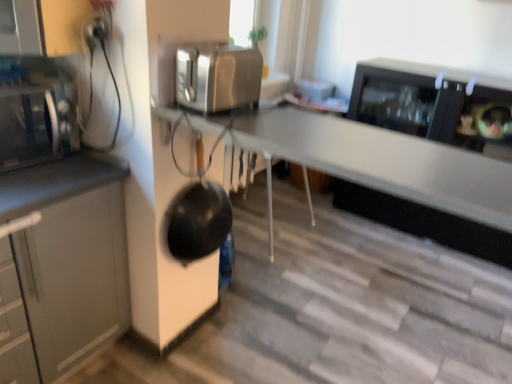
Question: Are matte black microwave at left and black matte wok at center far apart?

Choices:
 (A) no
 (B) yes

Answer: (A)

Question: From the image's perspective, is matte black microwave at left below black matte wok at center?

Choices:
 (A) yes
 (B) no

Answer: (B)

Question: Is matte black microwave at left closer to the viewer compared to black matte wok at center?

Choices:
 (A) yes
 (B) no

Answer: (A)

Question: Considering the relative sizes of matte black microwave at left and black matte wok at center in the image provided, is matte black microwave at left bigger than black matte wok at center?

Choices:
 (A) yes
 (B) no

Answer: (A)

Question: Does matte black microwave at left have a smaller size compared to black matte wok at center?

Choices:
 (A) no
 (B) yes

Answer: (A)

Question: Is matte black microwave at left taller or shorter than satin silver toaster at upper center?

Choices:
 (A) short
 (B) tall

Answer: (B)

Question: Looking at their shapes, would you say matte black microwave at left is wider or thinner than satin silver toaster at upper center?

Choices:
 (A) wide
 (B) thin

Answer: (A)

Question: Is matte black microwave at left bigger or smaller than satin silver toaster at upper center?

Choices:
 (A) small
 (B) big

Answer: (B)

Question: From a real-world perspective, is matte black microwave at left above or below satin silver toaster at upper center?

Choices:
 (A) below
 (B) above

Answer: (A)

Question: Considering the positions of point click(205, 48) and point click(193, 198), is point click(205, 48) closer or farther from the camera than point click(193, 198)?

Choices:
 (A) closer
 (B) farther

Answer: (A)

Question: In the image, is satin silver toaster at upper center positioned in front of or behind black matte wok at center?

Choices:
 (A) behind
 (B) front

Answer: (B)

Question: From the image's perspective, is satin silver toaster at upper center above or below black matte wok at center?

Choices:
 (A) above
 (B) below

Answer: (A)

Question: Visually, is satin silver toaster at upper center positioned to the left or to the right of black matte wok at center?

Choices:
 (A) right
 (B) left

Answer: (A)

Question: Looking at their shapes, would you say satin silver toaster at upper center is wider or thinner than matte black microwave at left?

Choices:
 (A) thin
 (B) wide

Answer: (A)

Question: From the image's perspective, relative to matte black microwave at left, is satin silver toaster at upper center above or below?

Choices:
 (A) above
 (B) below

Answer: (A)